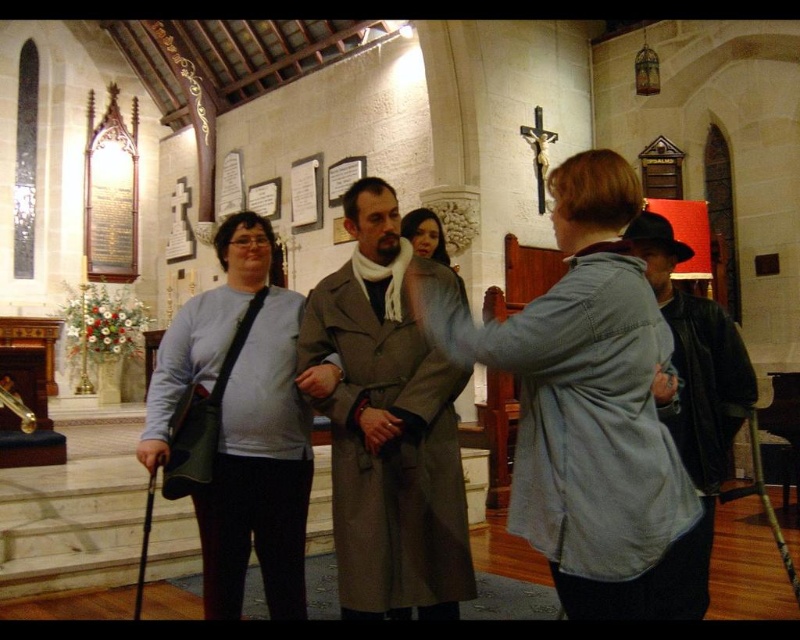
Based on the photo, you are standing in the church and need to locate the light blue sweater at center. According to the spatial coordinates provided, where would you find it?

The light blue sweater at center is located at point 0.742 on the x axis and 0.325 on the y axis.

Looking at this image, you are planning to place a 10 meter long banner between the light blue sweater at center and the dark brown leather jacket at right. Will the banner be long enough to stretch between them?

The distance between the light blue sweater at center and the dark brown leather jacket at right is 8.72 meters. The banner is 10 meters long, which is longer than the distance, so it will be sufficient to stretch between them.